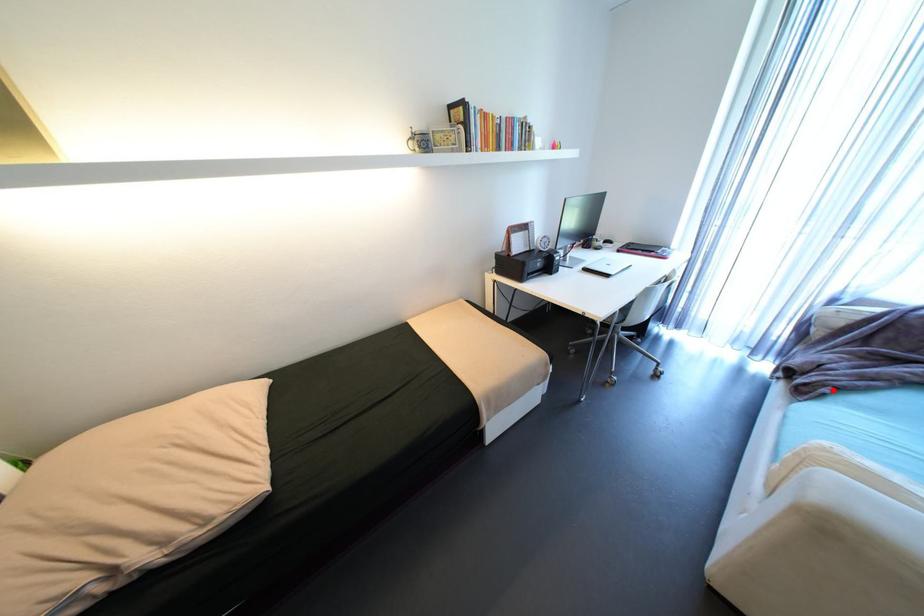
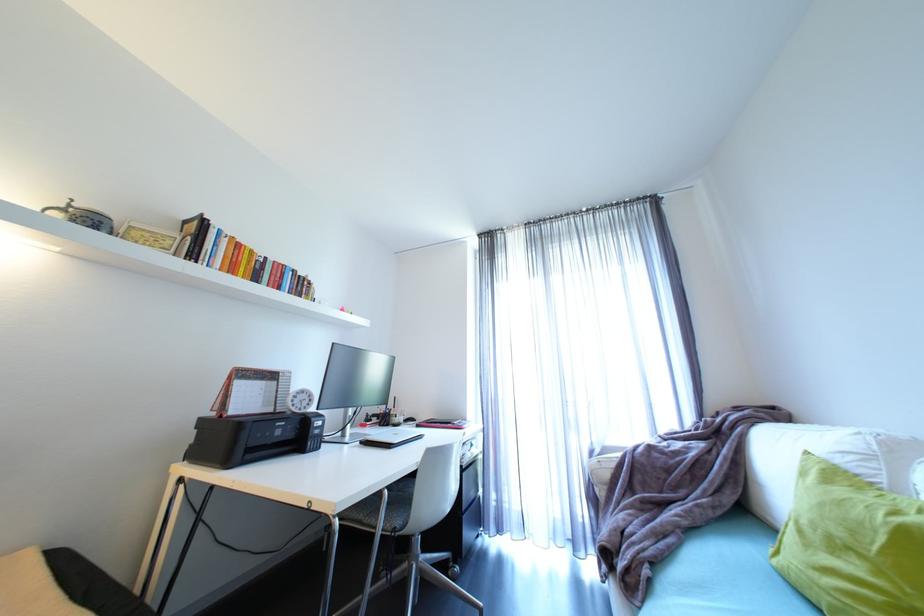
The point at the highlighted location is marked in the first image. Where is the corresponding point in the second image?

(653, 572)